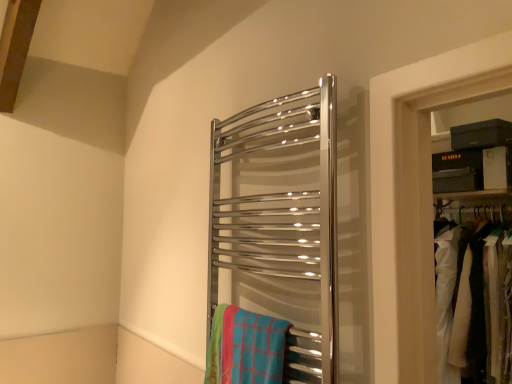
Question: Is white fabric at right inside polished chrome towel rack at center?

Choices:
 (A) yes
 (B) no

Answer: (B)

Question: Considering the relative positions of polished chrome towel rack at center and white fabric at right in the image provided, is polished chrome towel rack at center in front of white fabric at right?

Choices:
 (A) no
 (B) yes

Answer: (B)

Question: From the image's perspective, is polished chrome towel rack at center on white fabric at right?

Choices:
 (A) yes
 (B) no

Answer: (A)

Question: Considering the relative sizes of polished chrome towel rack at center and white fabric at right in the image provided, is polished chrome towel rack at center smaller than white fabric at right?

Choices:
 (A) yes
 (B) no

Answer: (A)

Question: From the image's perspective, is polished chrome towel rack at center located beneath white fabric at right?

Choices:
 (A) yes
 (B) no

Answer: (B)

Question: From a real-world perspective, is polished chrome towel rack at center above or below white fabric at right?

Choices:
 (A) below
 (B) above

Answer: (B)

Question: Would you say polished chrome towel rack at center is inside or outside white fabric at right?

Choices:
 (A) outside
 (B) inside

Answer: (A)

Question: Considering the positions of polished chrome towel rack at center and white fabric at right in the image, is polished chrome towel rack at center wider or thinner than white fabric at right?

Choices:
 (A) wide
 (B) thin

Answer: (B)

Question: From their relative heights in the image, would you say polished chrome towel rack at center is taller or shorter than white fabric at right?

Choices:
 (A) short
 (B) tall

Answer: (B)

Question: Is white fabric at right to the left or to the right of polished chrome towel rack at center in the image?

Choices:
 (A) left
 (B) right

Answer: (B)

Question: Considering the positions of white fabric at right and polished chrome towel rack at center in the image, is white fabric at right bigger or smaller than polished chrome towel rack at center?

Choices:
 (A) small
 (B) big

Answer: (B)

Question: Is white fabric at right situated inside polished chrome towel rack at center or outside?

Choices:
 (A) outside
 (B) inside

Answer: (A)

Question: From the image's perspective, is white fabric at right positioned above or below polished chrome towel rack at center?

Choices:
 (A) below
 (B) above

Answer: (A)

Question: In the image, is white fabric at right positioned in front of or behind blue plaid beach towel at center?

Choices:
 (A) behind
 (B) front

Answer: (A)

Question: From the image's perspective, relative to blue plaid beach towel at center, is white fabric at right above or below?

Choices:
 (A) above
 (B) below

Answer: (B)